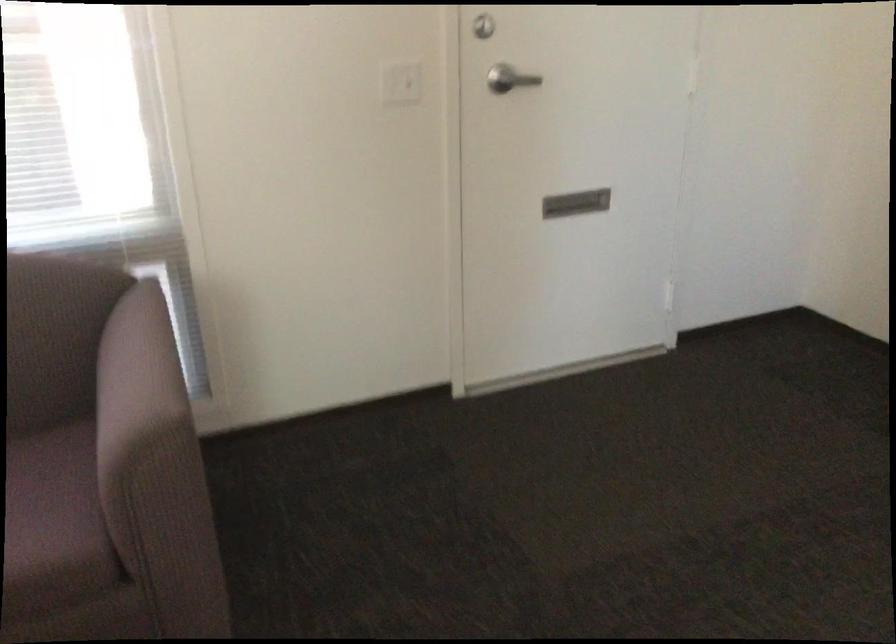
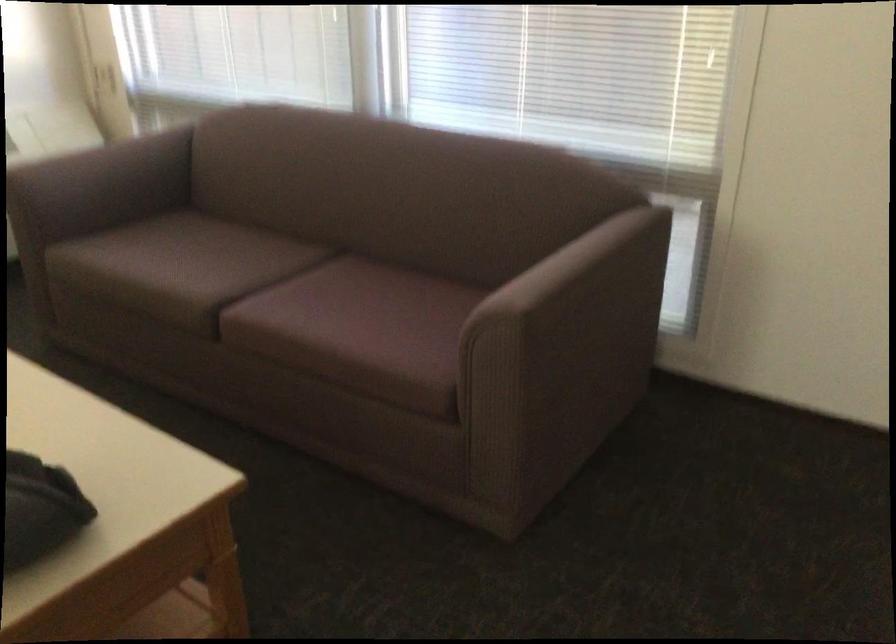
Find the pixel in the second image that matches (165,359) in the first image.

(579, 265)